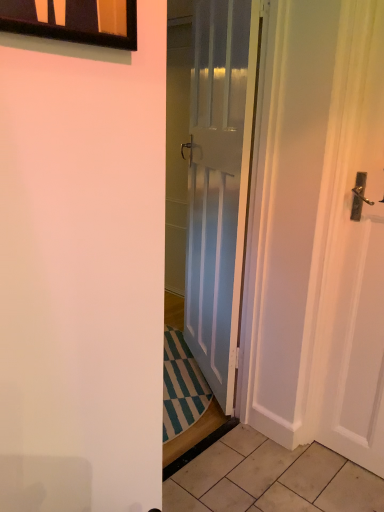
Locate an element on the screen. Image resolution: width=384 pixels, height=512 pixels. white glossy door at center is located at coordinates (218, 184).

You are a GUI agent. You are given a task and a screenshot of the screen. Output one action in this format:
    pyautogui.click(x=<x>, y=<y>)
    Task: Click on the black glass window at upper left
    The height and width of the screenshot is (512, 384).
    Given the screenshot: What is the action you would take?
    pyautogui.click(x=74, y=20)

Identify the location of beige tile at lower right. The height and width of the screenshot is (512, 384). [x=312, y=471].

I want to click on door that appears below the black glass window at upper left (from the image's perspective), so click(218, 184).

Which of these two, black glass window at upper left or white glossy door at center, is wider?

white glossy door at center.

Is there a large distance between black glass window at upper left and white glossy door at center?

Yes, black glass window at upper left and white glossy door at center are quite far apart.

From the image's perspective, which one is positioned lower, black glass window at upper left or white glossy door at center?

Answer: From the image's view, white glossy door at center is below.

From the image's perspective, relative to beige tile at lower right, is white glossy door at center above or below?

Based on their image positions, white glossy door at center is located above beige tile at lower right.

Who is bigger, white glossy door at center or beige tile at lower right?

white glossy door at center is bigger.

Is white glossy door at center in front of or behind beige tile at lower right in the image?

white glossy door at center is positioned closer to the viewer than beige tile at lower right.

Who is more distant, white glossy door at center or black glass window at upper left?

white glossy door at center is behind.

Which is in front, point (207, 106) or point (8, 24)?

Positioned in front is point (8, 24).

Is white glossy door at center taller or shorter than black glass window at upper left?

Clearly, white glossy door at center is taller compared to black glass window at upper left.

Considering the sizes of objects white glossy door at center and black glass window at upper left in the image provided, who is thinner, white glossy door at center or black glass window at upper left?

black glass window at upper left.

Is black glass window at upper left positioned in front of beige tile at lower right?

Yes, black glass window at upper left is in front of beige tile at lower right.

Between black glass window at upper left and beige tile at lower right, which one has larger size?

black glass window at upper left is bigger.

Which of these two, black glass window at upper left or beige tile at lower right, stands shorter?

beige tile at lower right is shorter.

Is black glass window at upper left next to beige tile at lower right and touching it?

They are not placed beside each other.

From a real-world perspective, which is physically above, beige tile at lower right or black glass window at upper left?

In real-world perspective, black glass window at upper left is above.

How many degrees apart are the facing directions of beige tile at lower right and black glass window at upper left?

The angle between the facing direction of beige tile at lower right and the facing direction of black glass window at upper left is 88.2 degrees.

Which is more distant, (307, 462) or (28, 3)?

The point (307, 462) is farther.

Is white glossy door at center surrounded by beige tile at lower right?

Definitely not — white glossy door at center is not inside beige tile at lower right.

Is beige tile at lower right thinner than white glossy door at center?

No.

Is beige tile at lower right directly adjacent to white glossy door at center?

No, beige tile at lower right is not touching white glossy door at center.

Is beige tile at lower right facing away from white glossy door at center?

No, beige tile at lower right is not facing the opposite direction of white glossy door at center.

In order to click on door located below the black glass window at upper left (from the image's perspective) in this screenshot , I will do `click(218, 184)`.

This screenshot has height=512, width=384. In order to click on tile that is on the right side of white glossy door at center in this screenshot , I will do `click(312, 471)`.

Looking at the image, which one is located closer to white glossy door at center, beige tile at lower right or black glass window at upper left?

beige tile at lower right.

Which object lies further to the anchor point black glass window at upper left, white glossy door at center or beige tile at lower right?

The object further to black glass window at upper left is beige tile at lower right.

Which object lies further to the anchor point beige tile at lower right, white glossy door at center or black glass window at upper left?

black glass window at upper left is further to beige tile at lower right.

Which object lies nearer to the anchor point black glass window at upper left, beige tile at lower right or white glossy door at center?

white glossy door at center is closer to black glass window at upper left.

Looking at the image, which one is located closer to white glossy door at center, black glass window at upper left or beige tile at lower right?

beige tile at lower right is positioned closer to the anchor white glossy door at center.

Looking at the image, which one is located closer to beige tile at lower right, black glass window at upper left or white glossy door at center?

Based on the image, white glossy door at center appears to be nearer to beige tile at lower right.

Image resolution: width=384 pixels, height=512 pixels. Find the location of `door that lies between black glass window at upper left and beige tile at lower right from top to bottom`. door that lies between black glass window at upper left and beige tile at lower right from top to bottom is located at coordinates (218, 184).